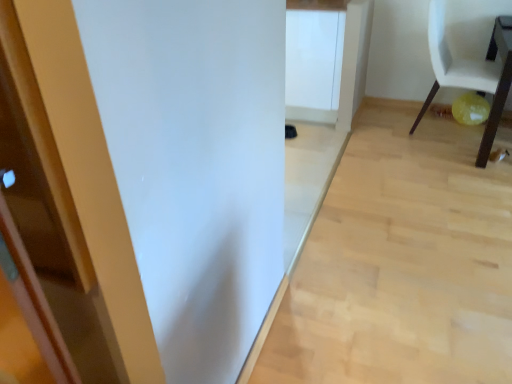
Question: Looking at the image, does white matte chair at right seem bigger or smaller compared to light wood floor at center?

Choices:
 (A) small
 (B) big

Answer: (B)

Question: Is point (489, 150) closer or farther from the camera than point (357, 296)?

Choices:
 (A) closer
 (B) farther

Answer: (B)

Question: Which object is the closest to the wooden table at lower right?

Choices:
 (A) light wood floor at center
 (B) white matte cabinet at center
 (C) white matte chair at right

Answer: (C)

Question: Which object is the farthest from the wooden table at lower right?

Choices:
 (A) white matte cabinet at center
 (B) white matte chair at right
 (C) light wood floor at center

Answer: (A)